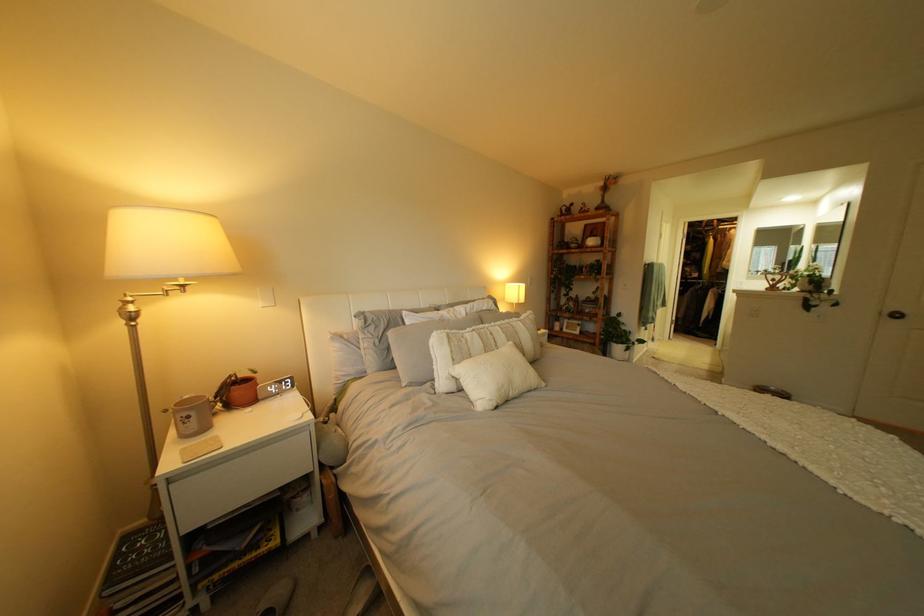
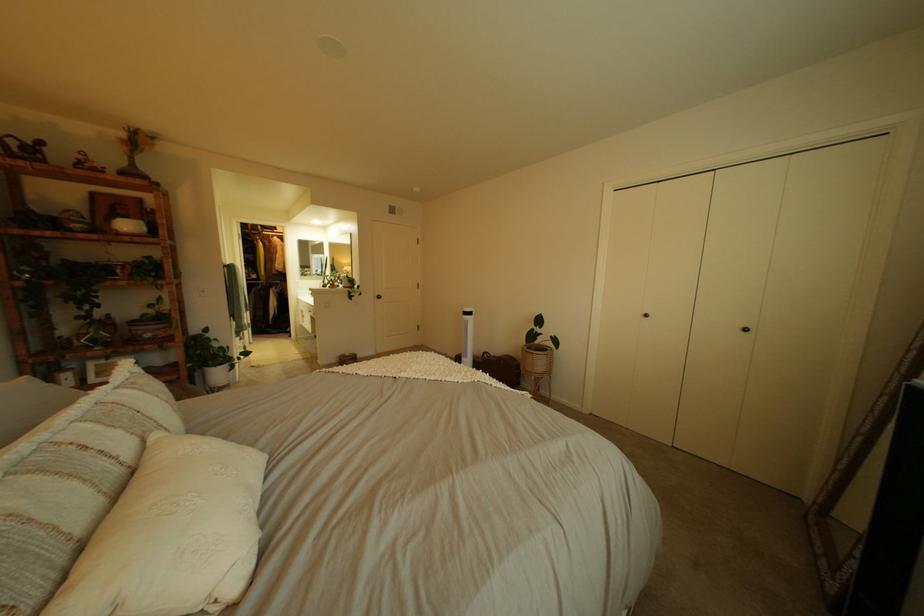
Find the pixel in the second image that matches (x=526, y=344) in the first image.

(172, 436)